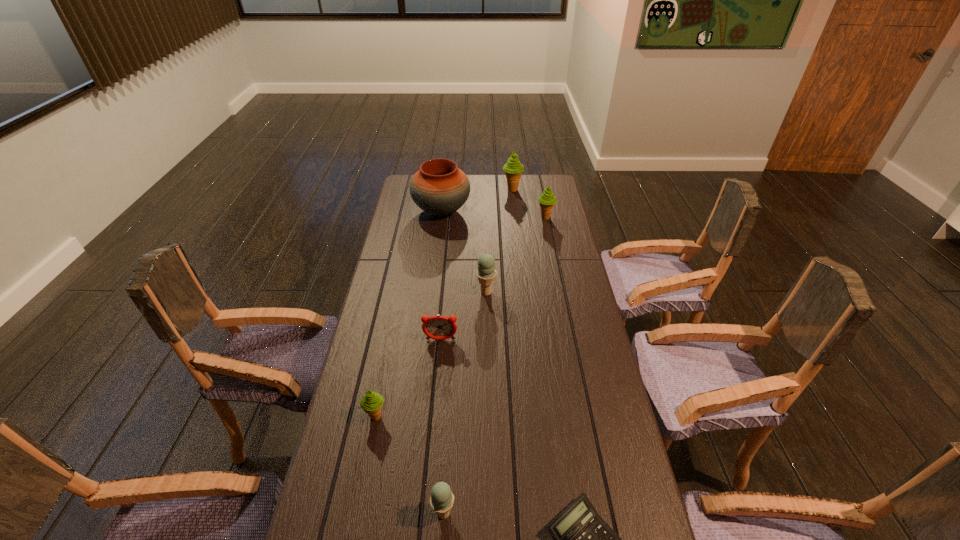
Locate an element on the screen. Image resolution: width=960 pixels, height=540 pixels. pottery that is at the far edge is located at coordinates (440, 188).

Where is `icecream present at the far edge`? The width and height of the screenshot is (960, 540). icecream present at the far edge is located at coordinates (513, 169).

Identify the location of pottery located at the left edge. (440, 188).

Locate an element on the screen. icecream situated at the left edge is located at coordinates (371, 403).

Where is `object at the right edge`? Image resolution: width=960 pixels, height=540 pixels. object at the right edge is located at coordinates (547, 200).

Identify the location of object located at the far left corner. The height and width of the screenshot is (540, 960). (440, 188).

The image size is (960, 540). Identify the location of free space at the far edge. (509, 192).

I want to click on free space at the left edge of the desktop, so click(412, 282).

This screenshot has height=540, width=960. In order to click on free space at the right edge of the desktop in this screenshot , I will do `click(569, 415)`.

Where is `vacant area that lies between the farther blue ice cream and the nearer blue ice cream`? Image resolution: width=960 pixels, height=540 pixels. vacant area that lies between the farther blue ice cream and the nearer blue ice cream is located at coordinates (465, 403).